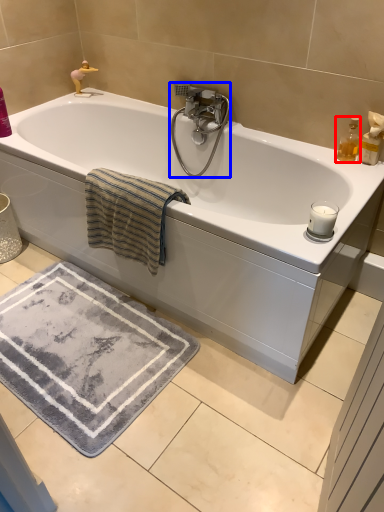
Question: Which point is closer to the camera, soap dispenser (highlighted by a red box) or tap (highlighted by a blue box)?

Choices:
 (A) soap dispenser
 (B) tap

Answer: (A)